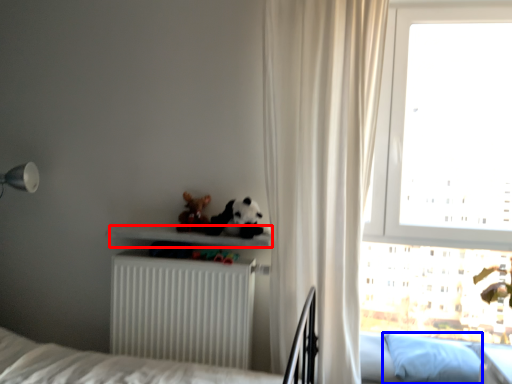
Question: Which object appears farthest to the camera in this image, shelf (highlighted by a red box) or pillow (highlighted by a blue box)?

Choices:
 (A) shelf
 (B) pillow

Answer: (A)